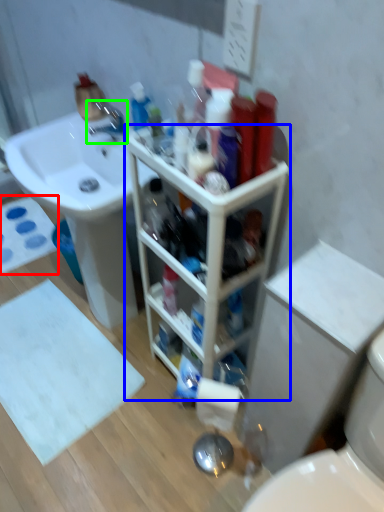
Question: Which object is positioned closest to bath mat (highlighted by a red box)? Select from bathroom cabinet (highlighted by a blue box) and tap (highlighted by a green box).

Choices:
 (A) bathroom cabinet
 (B) tap

Answer: (B)